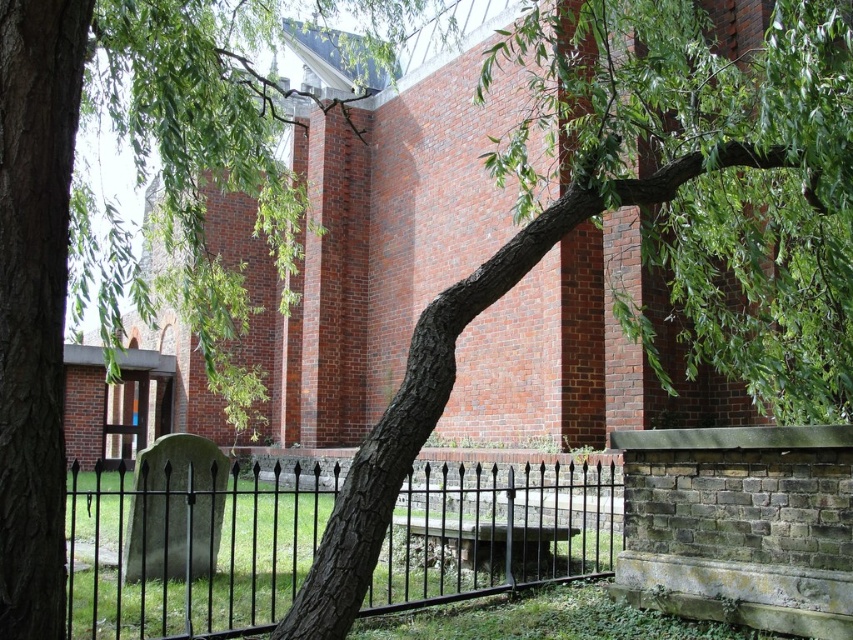
You are standing in front of the brick building and want to walk through the black wrought iron fence at center. Which direction should you go to avoid the green leafy branch at center?

Since the green leafy branch at center is to the right of the black wrought iron fence at center, you should go to the left side of the fence to avoid the branch.

You are a painter setting up an easel to paint the scene. You need to decide whether the smooth bark tree at center will block the view of the black wrought iron fence at center. Based on their heights, can you see the entire fence?

The smooth bark tree at center is taller than the black wrought iron fence at center, so it might block part of the fence from view depending on its branches, but since the fence is shorter, the tree could obscure the top part of the fence.

You are a gardener standing in front of the smooth bark tree at center and the black wrought iron fence at center. You want to trim the branches of the tree that are hanging over the fence. Which object is closer to you, allowing you to reach the branches easily?

The smooth bark tree at center is in front of the black wrought iron fence at center, so it is closer to you. Therefore, you can easily reach the branches of the smooth bark tree at center to trim them.